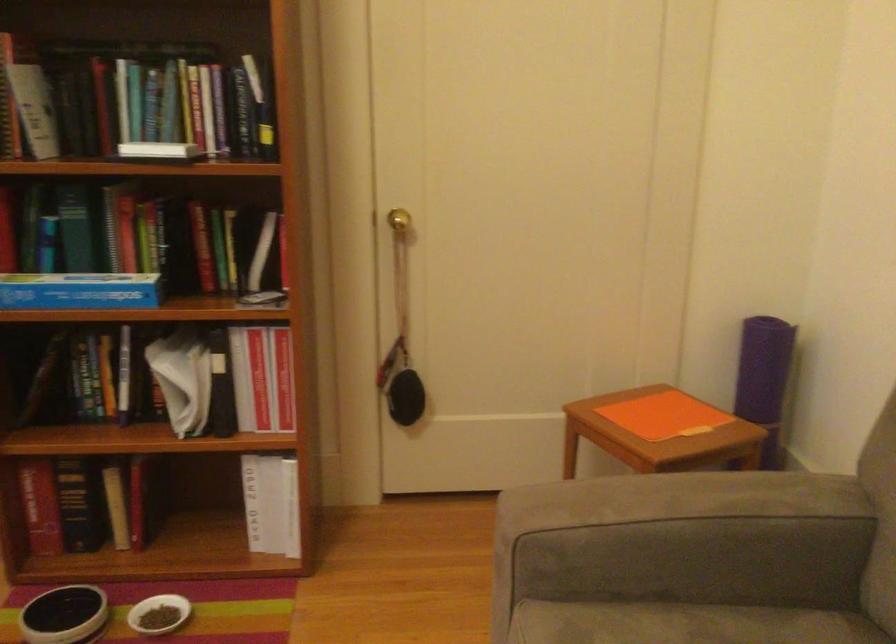
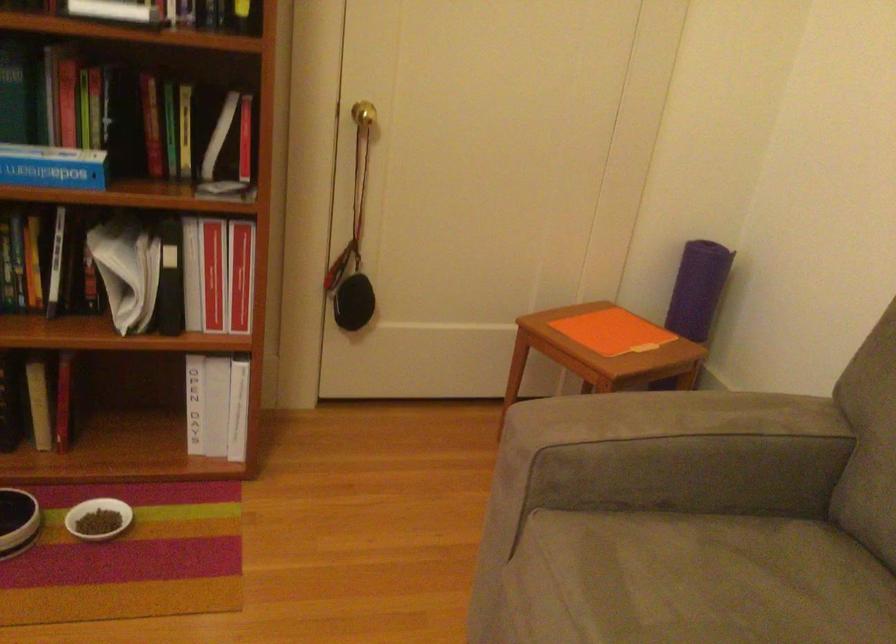
Where in the second image is the point corresponding to [674,542] from the first image?

(675, 453)